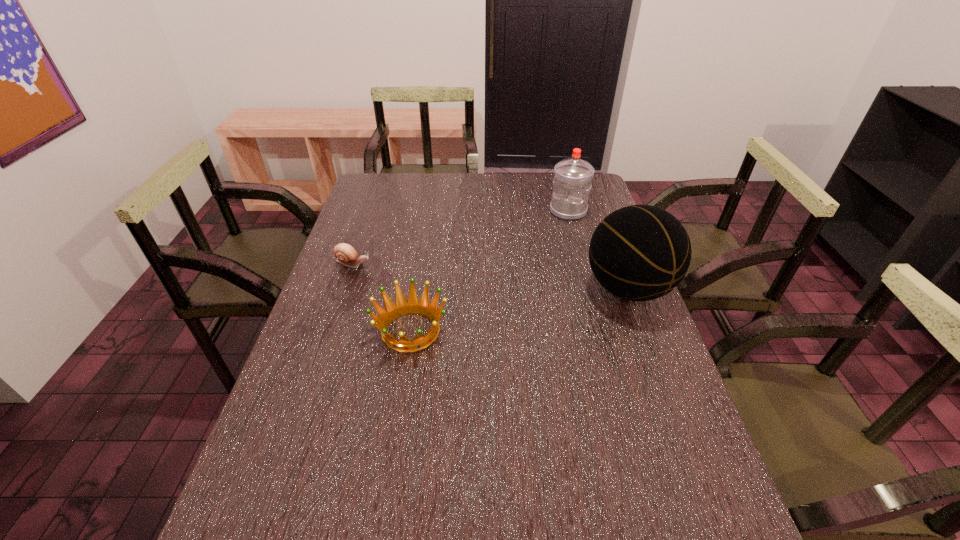
Where is `the third tallest object`? The height and width of the screenshot is (540, 960). the third tallest object is located at coordinates (402, 306).

Image resolution: width=960 pixels, height=540 pixels. Identify the location of crown. (402, 306).

Locate an element on the screen. basketball is located at coordinates (640, 252).

The image size is (960, 540). Identify the location of the farthest object. (572, 181).

I want to click on the shortest object, so click(x=345, y=253).

This screenshot has height=540, width=960. What are the coordinates of `the leftmost object` in the screenshot? It's located at (345, 253).

The width and height of the screenshot is (960, 540). I want to click on vacant space located 0.320m on the back of the crown, so click(425, 238).

You are a GUI agent. You are given a task and a screenshot of the screen. Output one action in this format:
    pyautogui.click(x=<x>, y=<y>)
    Task: Click on the free location located 0.200m on the back of the basketball
    The image size is (960, 540).
    Given the screenshot: What is the action you would take?
    pyautogui.click(x=604, y=225)

This screenshot has width=960, height=540. I want to click on vacant space located on the handle side of the farthest object, so click(x=517, y=283).

The image size is (960, 540). What are the coordinates of `vacant region located on the handle side of the farthest object` in the screenshot? It's located at [x=556, y=228].